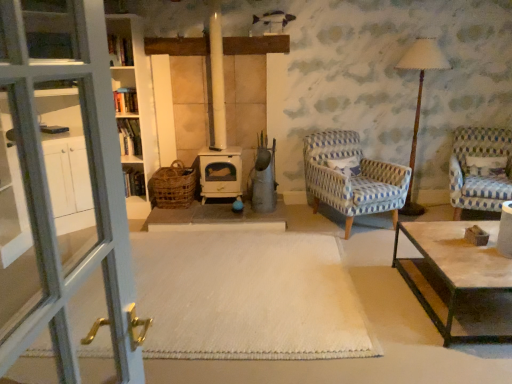
Question: From the image's perspective, would you say rustic wicker basket at center is positioned over wooden bookshelf at center?

Choices:
 (A) no
 (B) yes

Answer: (A)

Question: Can you confirm if rustic wicker basket at center is wider than wooden bookshelf at center?

Choices:
 (A) yes
 (B) no

Answer: (A)

Question: From the image's perspective, would you say rustic wicker basket at center is shown under wooden bookshelf at center?

Choices:
 (A) no
 (B) yes

Answer: (B)

Question: Can you confirm if rustic wicker basket at center is positioned to the right of wooden bookshelf at center?

Choices:
 (A) yes
 (B) no

Answer: (A)

Question: Is rustic wicker basket at center next to wooden bookshelf at center?

Choices:
 (A) no
 (B) yes

Answer: (A)

Question: From the image's perspective, is rustic wicker basket at center positioned above or below white carpet at center?

Choices:
 (A) below
 (B) above

Answer: (B)

Question: Is rustic wicker basket at center spatially inside white carpet at center, or outside of it?

Choices:
 (A) inside
 (B) outside

Answer: (B)

Question: From a real-world perspective, is rustic wicker basket at center physically located above or below white carpet at center?

Choices:
 (A) above
 (B) below

Answer: (A)

Question: From their relative heights in the image, would you say rustic wicker basket at center is taller or shorter than white carpet at center?

Choices:
 (A) short
 (B) tall

Answer: (B)

Question: Considering the positions of rustic wicker basket at center and white textured pillow at right in the image, is rustic wicker basket at center bigger or smaller than white textured pillow at right?

Choices:
 (A) small
 (B) big

Answer: (B)

Question: Do you think rustic wicker basket at center is within white textured pillow at right, or outside of it?

Choices:
 (A) inside
 (B) outside

Answer: (B)

Question: From the image's perspective, is rustic wicker basket at center above or below white textured pillow at right?

Choices:
 (A) below
 (B) above

Answer: (A)

Question: Is rustic wicker basket at center to the left or to the right of white textured pillow at right in the image?

Choices:
 (A) left
 (B) right

Answer: (A)

Question: From the image's perspective, is wooden bookshelf at center located above or below blue and white woven armchair at center-right, positioned as the second chair in right-to-left order?

Choices:
 (A) below
 (B) above

Answer: (A)

Question: Based on their sizes in the image, would you say wooden bookshelf at center is bigger or smaller than blue and white woven armchair at center-right, which ranks as the 1th chair in left-to-right order?

Choices:
 (A) big
 (B) small

Answer: (B)